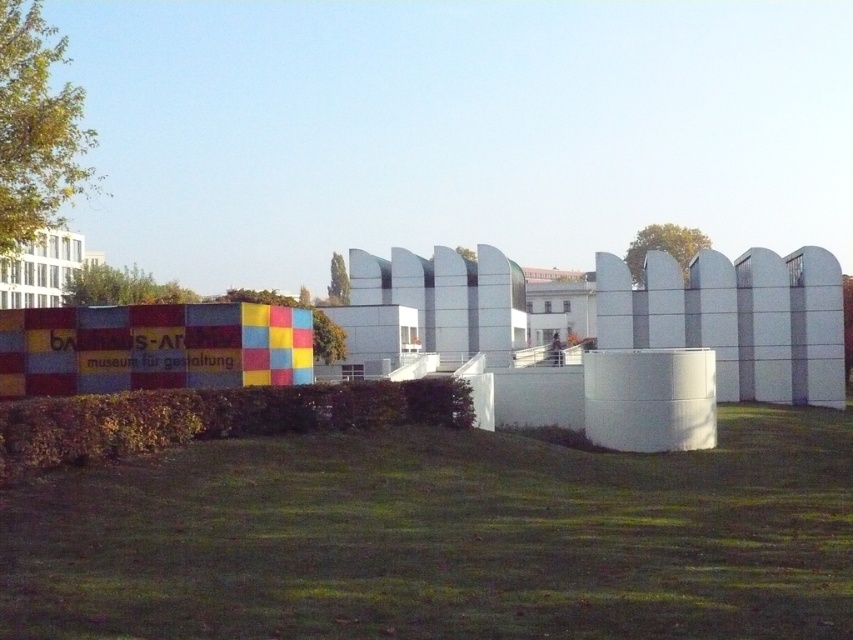
Can you confirm if white smooth fence at center is positioned above green leafy hedge at lower center?

Yes, white smooth fence at center is above green leafy hedge at lower center.

Between point (834, 291) and point (140, 445), which one is positioned in front?

Positioned in front is point (140, 445).

Where is `white smooth fence at center`? This screenshot has height=640, width=853. white smooth fence at center is located at coordinates (734, 317).

Between green grass at lower center and white smooth fence at center, which one is positioned higher?

white smooth fence at center is higher up.

The width and height of the screenshot is (853, 640). What do you see at coordinates (444, 538) in the screenshot?
I see `green grass at lower center` at bounding box center [444, 538].

Which is in front, point (495, 634) or point (439, 296)?

Positioned in front is point (495, 634).

This screenshot has width=853, height=640. Find the location of `green grass at lower center`. green grass at lower center is located at coordinates (444, 538).

Does green grass at lower center come in front of green leafy hedge at lower center?

Yes, it is.

Does green grass at lower center appear under green leafy hedge at lower center?

Correct, green grass at lower center is located below green leafy hedge at lower center.

The height and width of the screenshot is (640, 853). What do you see at coordinates (444, 538) in the screenshot?
I see `green grass at lower center` at bounding box center [444, 538].

Identify the location of green grass at lower center. (444, 538).